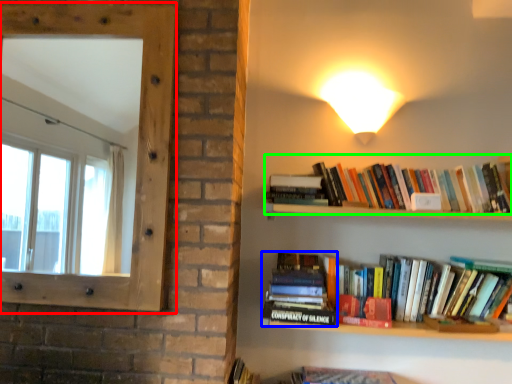
Question: Which object is the closest to the window screen (highlighted by a red box)? Choose among these: book (highlighted by a blue box) or book (highlighted by a green box).

Choices:
 (A) book
 (B) book

Answer: (A)